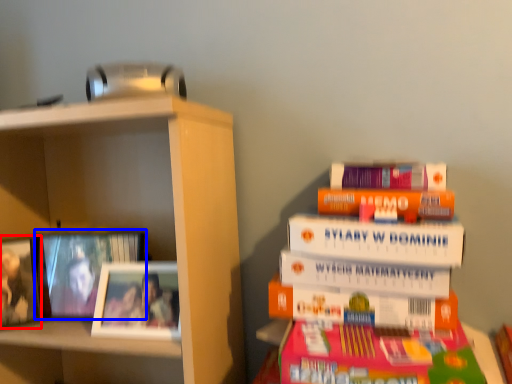
Question: Which object appears closest to the camera in this image, picture frame (highlighted by a red box) or picture frame (highlighted by a blue box)?

Choices:
 (A) picture frame
 (B) picture frame

Answer: (A)